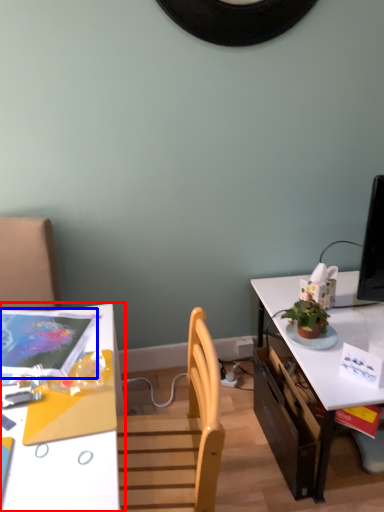
Question: Among these objects, which one is nearest to the camera, desk (highlighted by a red box) or magazine (highlighted by a blue box)?

Choices:
 (A) desk
 (B) magazine

Answer: (A)